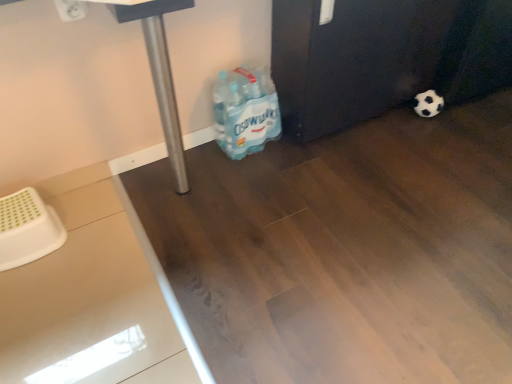
Find the location of `vacant area that is in front of blue plastic water bottles at lower center`. vacant area that is in front of blue plastic water bottles at lower center is located at coordinates (246, 177).